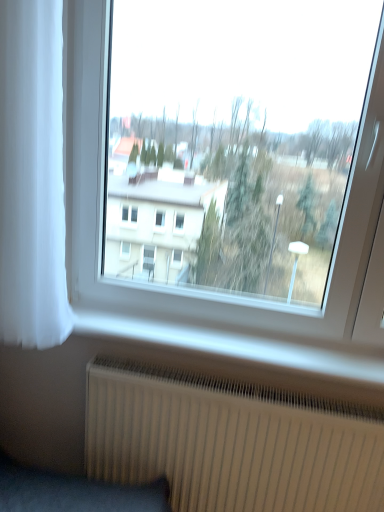
Question: Is white ribbed radiator at lower center not near white sheer curtain at left?

Choices:
 (A) yes
 (B) no

Answer: (B)

Question: Can you confirm if white ribbed radiator at lower center is wider than white sheer curtain at left?

Choices:
 (A) yes
 (B) no

Answer: (B)

Question: Is white ribbed radiator at lower center to the right of white sheer curtain at left from the viewer's perspective?

Choices:
 (A) yes
 (B) no

Answer: (A)

Question: Does white ribbed radiator at lower center have a lesser height compared to white sheer curtain at left?

Choices:
 (A) yes
 (B) no

Answer: (A)

Question: Is white ribbed radiator at lower center oriented away from white sheer curtain at left?

Choices:
 (A) no
 (B) yes

Answer: (A)

Question: Considering the relative positions of white ribbed radiator at lower center and white sheer curtain at left in the image provided, is white ribbed radiator at lower center to the left of white sheer curtain at left from the viewer's perspective?

Choices:
 (A) no
 (B) yes

Answer: (A)

Question: Does transparent glass window at center have a greater height compared to white ribbed radiator at lower center?

Choices:
 (A) no
 (B) yes

Answer: (B)

Question: From a real-world perspective, is transparent glass window at center located higher than white ribbed radiator at lower center?

Choices:
 (A) yes
 (B) no

Answer: (A)

Question: Is transparent glass window at center completely or partially outside of white ribbed radiator at lower center?

Choices:
 (A) no
 (B) yes

Answer: (B)

Question: Is the position of transparent glass window at center more distant than that of white ribbed radiator at lower center?

Choices:
 (A) yes
 (B) no

Answer: (B)

Question: Is white ribbed radiator at lower center inside transparent glass window at center?

Choices:
 (A) yes
 (B) no

Answer: (B)

Question: Are transparent glass window at center and white ribbed radiator at lower center located far from each other?

Choices:
 (A) no
 (B) yes

Answer: (B)

Question: Would you say white sheer curtain at left is outside white ribbed radiator at lower center?

Choices:
 (A) yes
 (B) no

Answer: (A)